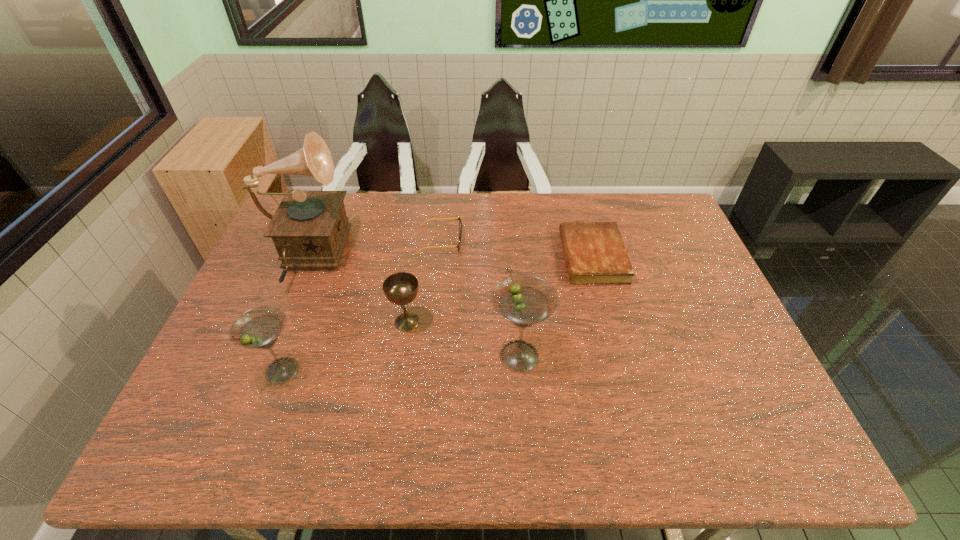
Locate an element on the screen. The height and width of the screenshot is (540, 960). the left martini is located at coordinates (258, 328).

The width and height of the screenshot is (960, 540). Find the location of `the shorter martini`. the shorter martini is located at coordinates (258, 328).

Image resolution: width=960 pixels, height=540 pixels. What are the coordinates of `the right martini` in the screenshot? It's located at (524, 300).

Find the location of a particular element. the fifth shortest object is located at coordinates (524, 300).

Locate an element on the screen. The width and height of the screenshot is (960, 540). spectacles is located at coordinates (460, 222).

This screenshot has height=540, width=960. In order to click on the rightmost object in this screenshot , I will do click(595, 253).

Locate an element on the screen. the tallest object is located at coordinates (309, 229).

What are the coordinates of `chalice` in the screenshot? It's located at (401, 288).

Find the location of a particular element. vacant space situated on the right of the fourth shortest object is located at coordinates (459, 370).

This screenshot has height=540, width=960. What are the coordinates of `vacant area situated 0.260m on the right of the taller martini` in the screenshot? It's located at (651, 356).